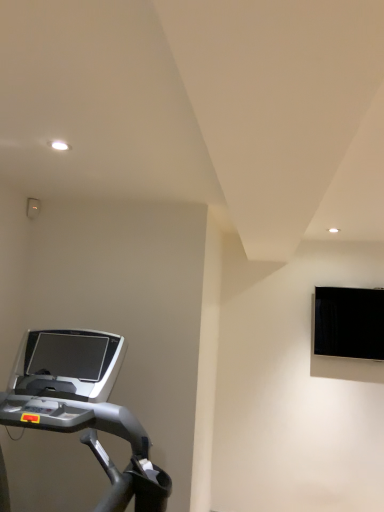
The width and height of the screenshot is (384, 512). Describe the element at coordinates (349, 322) in the screenshot. I see `black glossy monitor at upper right` at that location.

Where is `black glossy monitor at upper right`? The width and height of the screenshot is (384, 512). black glossy monitor at upper right is located at coordinates (349, 322).

This screenshot has height=512, width=384. What do you see at coordinates (84, 408) in the screenshot?
I see `silver metallic treadmill at lower left` at bounding box center [84, 408].

Find the location of a particular element. The width and height of the screenshot is (384, 512). silver metallic treadmill at lower left is located at coordinates (84, 408).

What is the approximate width of silver metallic treadmill at lower left?

It is 1.12 meters.

The image size is (384, 512). In order to click on black glossy monitor at upper right in this screenshot , I will do point(349,322).

Does black glossy monitor at upper right appear on the right side of silver metallic treadmill at lower left?

Indeed, black glossy monitor at upper right is positioned on the right side of silver metallic treadmill at lower left.

Looking at this image, is the depth of black glossy monitor at upper right greater than that of silver metallic treadmill at lower left?

That is True.

Which is nearer, (x=331, y=288) or (x=121, y=476)?

Point (x=331, y=288) appears to be farther away from the viewer than point (x=121, y=476).

From the image's perspective, is black glossy monitor at upper right beneath silver metallic treadmill at lower left?

No, from the image's perspective, black glossy monitor at upper right is not below silver metallic treadmill at lower left.

From a real-world perspective, is black glossy monitor at upper right physically located above or below silver metallic treadmill at lower left?

black glossy monitor at upper right is situated higher than silver metallic treadmill at lower left in the real world.

Is black glossy monitor at upper right wider than silver metallic treadmill at lower left?

In fact, black glossy monitor at upper right might be narrower than silver metallic treadmill at lower left.

From their relative heights in the image, would you say black glossy monitor at upper right is taller or shorter than silver metallic treadmill at lower left?

black glossy monitor at upper right is shorter than silver metallic treadmill at lower left.

Does black glossy monitor at upper right have a larger size compared to silver metallic treadmill at lower left?

Incorrect, black glossy monitor at upper right is not larger than silver metallic treadmill at lower left.

Can silver metallic treadmill at lower left be found inside black glossy monitor at upper right?

That's incorrect, silver metallic treadmill at lower left is not inside black glossy monitor at upper right.

Is black glossy monitor at upper right far from silver metallic treadmill at lower left?

black glossy monitor at upper right is far away from silver metallic treadmill at lower left.

Could you tell me if black glossy monitor at upper right is turned towards silver metallic treadmill at lower left?

No, black glossy monitor at upper right does not turn towards silver metallic treadmill at lower left.

The image size is (384, 512). Identify the location of treadmill that is below the black glossy monitor at upper right (from the image's perspective). (84, 408).

Is silver metallic treadmill at lower left to the left or to the right of black glossy monitor at upper right in the image?

Clearly, silver metallic treadmill at lower left is on the left of black glossy monitor at upper right in the image.

Is the position of silver metallic treadmill at lower left more distant than that of black glossy monitor at upper right?

No, silver metallic treadmill at lower left is in front of black glossy monitor at upper right.

Does point (43, 351) appear closer or farther from the camera than point (381, 351)?

Point (43, 351) appears to be closer to the viewer than point (381, 351).

From the image's perspective, would you say silver metallic treadmill at lower left is shown under black glossy monitor at upper right?

Yes, from the image's perspective, silver metallic treadmill at lower left is below black glossy monitor at upper right.

From a real-world perspective, is silver metallic treadmill at lower left on top of black glossy monitor at upper right?

No.

In the scene shown: Does silver metallic treadmill at lower left have a lesser width compared to black glossy monitor at upper right?

No.

Who is taller, silver metallic treadmill at lower left or black glossy monitor at upper right?

With more height is silver metallic treadmill at lower left.

Does silver metallic treadmill at lower left have a larger size compared to black glossy monitor at upper right?

Indeed, silver metallic treadmill at lower left has a larger size compared to black glossy monitor at upper right.

Choose the correct answer: Is silver metallic treadmill at lower left inside black glossy monitor at upper right or outside it?

silver metallic treadmill at lower left exists outside the volume of black glossy monitor at upper right.

Is silver metallic treadmill at lower left not near black glossy monitor at upper right?

silver metallic treadmill at lower left is far away from black glossy monitor at upper right.

Could you tell me if silver metallic treadmill at lower left is facing black glossy monitor at upper right?

No, silver metallic treadmill at lower left is not facing towards black glossy monitor at upper right.

Consider the image. How different are the orientations of silver metallic treadmill at lower left and black glossy monitor at upper right in degrees?

The angle between the facing direction of silver metallic treadmill at lower left and the facing direction of black glossy monitor at upper right is 90.9 degrees.

How much distance is there between silver metallic treadmill at lower left and black glossy monitor at upper right?

silver metallic treadmill at lower left and black glossy monitor at upper right are 1.90 meters apart.

Locate an element on the screen. This screenshot has height=512, width=384. computer monitor above the silver metallic treadmill at lower left (from the image's perspective) is located at coordinates (349, 322).

At what (x,y) coordinates should I click in order to perform the action: click on computer monitor that appears above the silver metallic treadmill at lower left (from a real-world perspective). Please return your answer as a coordinate pair (x, y). Image resolution: width=384 pixels, height=512 pixels. Looking at the image, I should click on (349, 322).

The height and width of the screenshot is (512, 384). What are the coordinates of `treadmill in front of the black glossy monitor at upper right` in the screenshot? It's located at (84, 408).